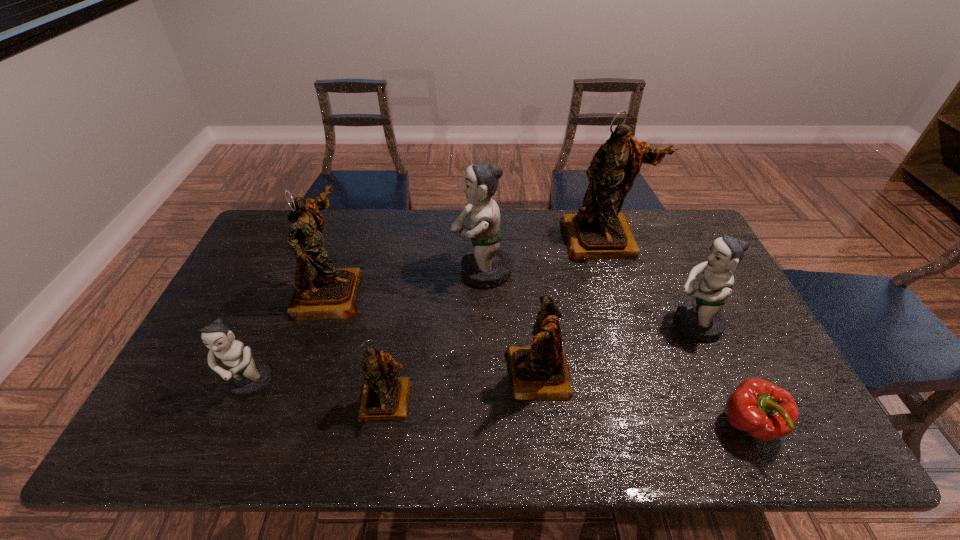
Find the location of a particular element. This screenshot has height=540, width=960. figurine that can be found as the fourth closest to the shortest object is located at coordinates (486, 265).

This screenshot has height=540, width=960. Find the location of `gold figurine that stands as the closest to the second green figurine from left to right`. gold figurine that stands as the closest to the second green figurine from left to right is located at coordinates (598, 231).

You are a GUI agent. You are given a task and a screenshot of the screen. Output one action in this format:
    pyautogui.click(x=<x>, y=<y>)
    Task: Click on the second closest gold figurine to the farthest green figurine
    The height and width of the screenshot is (540, 960).
    Given the screenshot: What is the action you would take?
    pyautogui.click(x=539, y=372)

At what (x,y) coordinates should I click in order to perform the action: click on the second closest green figurine relative to the third biggest gold figurine. Please return your answer as a coordinate pair (x, y). Looking at the image, I should click on (701, 319).

Locate which green figurine ranks second in proximity to the second biggest green figurine. Please provide its 2D coordinates. Your answer should be formatted as a tuple, i.e. [(x, y)], where the tuple contains the x and y coordinates of a point satisfying the conditions above.

[(246, 377)]

Find the location of a particular element. The image size is (960, 540). vacant space that satisfies the following two spatial constraints: 1. on the front-facing side of the farthest green figurine; 2. on the back side of the shortest object is located at coordinates (483, 426).

Identify the location of vacant space that satisfies the following two spatial constraints: 1. on the front-facing side of the second smallest green figurine; 2. on the back side of the shortest object. This screenshot has width=960, height=540. (740, 426).

Find the location of a particular element. Image resolution: width=960 pixels, height=540 pixels. free space that satisfies the following two spatial constraints: 1. on the front-facing side of the nearest green figurine; 2. on the left side of the pink pepper is located at coordinates (232, 426).

You are a GUI agent. You are given a task and a screenshot of the screen. Output one action in this format:
    pyautogui.click(x=<x>, y=<y>)
    Task: Click on the blank area in the image that satisfies the following two spatial constraints: 1. on the front-facing side of the third biggest gold figurine; 2. on the front-facing side of the third gold figurine from right to left
    The image size is (960, 540).
    Given the screenshot: What is the action you would take?
    pyautogui.click(x=541, y=401)

The image size is (960, 540). Find the location of `vacant area in the image that satisfies the following two spatial constraints: 1. on the front-facing side of the shortest object; 2. on the left side of the second smallest gold figurine`. vacant area in the image that satisfies the following two spatial constraints: 1. on the front-facing side of the shortest object; 2. on the left side of the second smallest gold figurine is located at coordinates (544, 426).